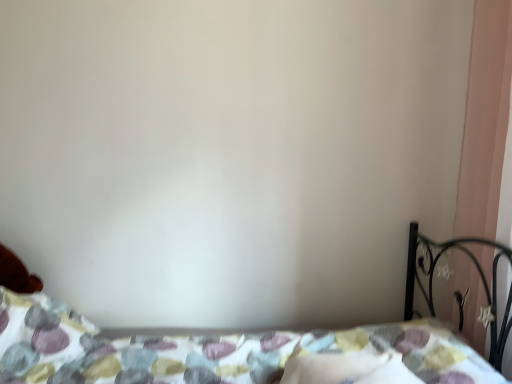
You are a GUI agent. You are given a task and a screenshot of the screen. Output one action in this format:
    pyautogui.click(x=<x>, y=<y>)
    Task: Click on the pink matte curtain at right
    The width and height of the screenshot is (512, 384).
    Given the screenshot: What is the action you would take?
    pyautogui.click(x=487, y=127)

Find the location of a particular element. patterned fabric bed at lower center is located at coordinates (228, 353).

The image size is (512, 384). Find the location of `white soft pillow at lower center`. white soft pillow at lower center is located at coordinates (348, 369).

From the image's perspective, which is below, white soft pillow at lower center or pink matte curtain at right?

white soft pillow at lower center appears lower in the image.

Could you tell me if white soft pillow at lower center is turned towards pink matte curtain at right?

No, white soft pillow at lower center is not turned towards pink matte curtain at right.

Does point (331, 369) come behind point (490, 129)?

That is False.

In the scene shown: Considering the relative sizes of white soft pillow at lower center and pink matte curtain at right in the image provided, is white soft pillow at lower center thinner than pink matte curtain at right?

No.

From the image's perspective, which one is positioned higher, patterned fabric bed at lower center or white soft pillow at lower center?

white soft pillow at lower center appears higher in the image.

The height and width of the screenshot is (384, 512). Find the location of `pillow above the patterned fabric bed at lower center (from a real-world perspective)`. pillow above the patterned fabric bed at lower center (from a real-world perspective) is located at coordinates (348, 369).

Can you confirm if patterned fabric bed at lower center is positioned to the left of white soft pillow at lower center?

Yes.

Looking at the image, does pink matte curtain at right seem bigger or smaller compared to patterned fabric bed at lower center?

pink matte curtain at right is smaller than patterned fabric bed at lower center.

From the image's perspective, who appears lower, pink matte curtain at right or patterned fabric bed at lower center?

patterned fabric bed at lower center.

Is patterned fabric bed at lower center surrounded by pink matte curtain at right?

No, pink matte curtain at right does not contain patterned fabric bed at lower center.

Could you tell me if pink matte curtain at right is facing patterned fabric bed at lower center?

Yes, pink matte curtain at right is turned towards patterned fabric bed at lower center.

From a real-world perspective, between white soft pillow at lower center and patterned fabric bed at lower center, who is vertically lower?

From a 3D spatial view, patterned fabric bed at lower center is below.

Can you confirm if white soft pillow at lower center is thinner than patterned fabric bed at lower center?

Indeed, white soft pillow at lower center has a lesser width compared to patterned fabric bed at lower center.

Is white soft pillow at lower center positioned before patterned fabric bed at lower center?

No, the depth of white soft pillow at lower center is greater than that of patterned fabric bed at lower center.

From the image's perspective, which is below, white soft pillow at lower center or patterned fabric bed at lower center?

patterned fabric bed at lower center is shown below in the image.

From the image's perspective, is patterned fabric bed at lower center above or below pink matte curtain at right?

patterned fabric bed at lower center is below pink matte curtain at right.

From a real-world perspective, which is physically below, patterned fabric bed at lower center or pink matte curtain at right?

patterned fabric bed at lower center.

Does patterned fabric bed at lower center appear on the left side of pink matte curtain at right?

Yes, patterned fabric bed at lower center is to the left of pink matte curtain at right.

Considering the relative positions of pink matte curtain at right and white soft pillow at lower center in the image provided, is pink matte curtain at right to the left of white soft pillow at lower center from the viewer's perspective?

Incorrect, pink matte curtain at right is not on the left side of white soft pillow at lower center.

Is white soft pillow at lower center at the back of pink matte curtain at right?

No, pink matte curtain at right is not facing the opposite direction of white soft pillow at lower center.

Is pink matte curtain at right far away from white soft pillow at lower center?

No.

Identify the location of curtain in front of the white soft pillow at lower center. (487, 127).

In order to click on pillow behind the patterned fabric bed at lower center in this screenshot , I will do `click(348, 369)`.

From the image, which object appears to be farther from white soft pillow at lower center, patterned fabric bed at lower center or pink matte curtain at right?

pink matte curtain at right is further to white soft pillow at lower center.

From the image, which object appears to be nearer to patterned fabric bed at lower center, pink matte curtain at right or white soft pillow at lower center?

Among the two, white soft pillow at lower center is located nearer to patterned fabric bed at lower center.

Looking at the image, which one is located further to white soft pillow at lower center, pink matte curtain at right or patterned fabric bed at lower center?

pink matte curtain at right.

Considering their positions, is white soft pillow at lower center positioned further to patterned fabric bed at lower center than pink matte curtain at right?

pink matte curtain at right.

Based on their spatial positions, is white soft pillow at lower center or patterned fabric bed at lower center further from pink matte curtain at right?

patterned fabric bed at lower center is positioned further to the anchor pink matte curtain at right.

From the picture: Estimate the real-world distances between objects in this image. Which object is closer to pink matte curtain at right, patterned fabric bed at lower center or white soft pillow at lower center?

Based on the image, white soft pillow at lower center appears to be nearer to pink matte curtain at right.

Identify the location of pillow between patterned fabric bed at lower center and pink matte curtain at right. The width and height of the screenshot is (512, 384). (348, 369).